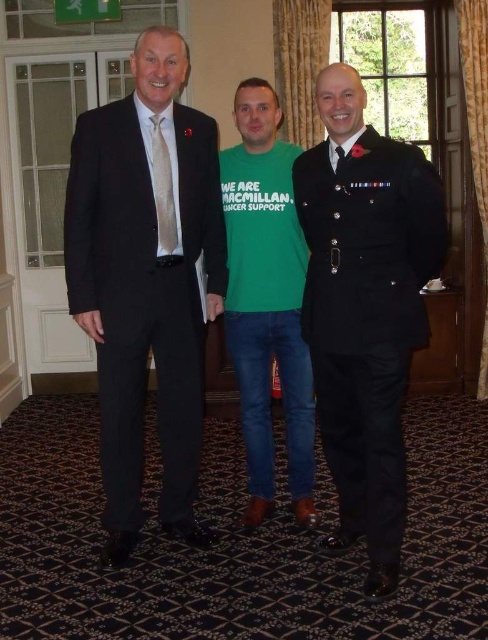
What is located at the coordinates point (146, 280) in the image?

The black matte suit at left is located at point (146, 280).

Based on the scene description, where is the uniformed man at center located in terms of coordinates?

The uniformed man at center is located at point (366, 307).